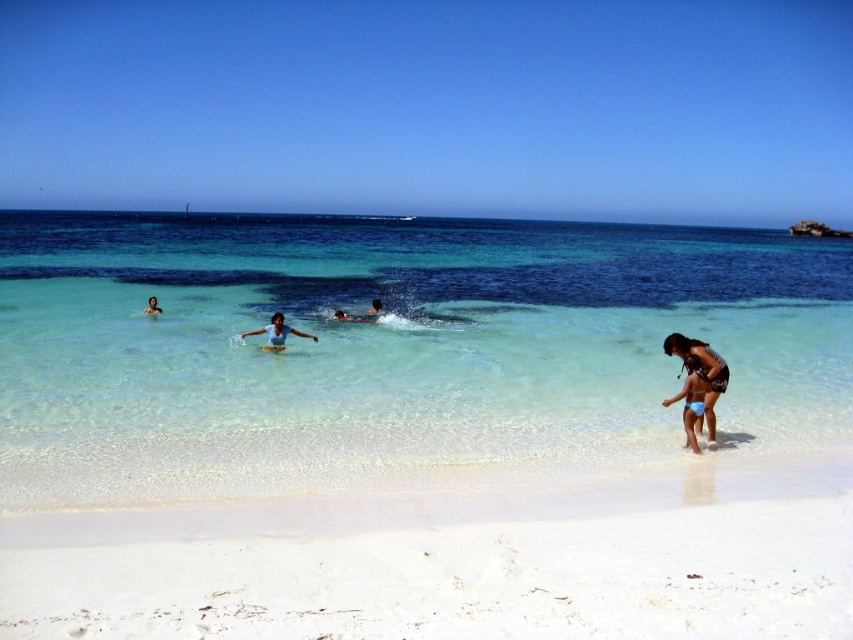
Is smooth skin person at center smaller than light blue fabric at center?

No, smooth skin person at center is not smaller than light blue fabric at center.

Can you confirm if smooth skin person at center is thinner than light blue fabric at center?

Yes, smooth skin person at center is thinner than light blue fabric at center.

Does point (378, 307) come closer to viewer compared to point (148, 301)?

Yes.

This screenshot has width=853, height=640. Identify the location of smooth skin person at center. (373, 308).

Can you confirm if clear water at center is taller than matte black bikini at lower right?

Yes.

Does clear water at center have a smaller size compared to matte black bikini at lower right?

Actually, clear water at center might be larger than matte black bikini at lower right.

Locate an element on the screen. clear water at center is located at coordinates (392, 348).

Where is `clear water at center`? clear water at center is located at coordinates (392, 348).

Which of these two, clear water at center or matte blue swimsuit at center, stands shorter?

Standing shorter between the two is matte blue swimsuit at center.

Who is taller, clear water at center or matte blue swimsuit at center?

clear water at center

The width and height of the screenshot is (853, 640). What do you see at coordinates (392, 348) in the screenshot?
I see `clear water at center` at bounding box center [392, 348].

Image resolution: width=853 pixels, height=640 pixels. Find the location of `clear water at center`. clear water at center is located at coordinates (392, 348).